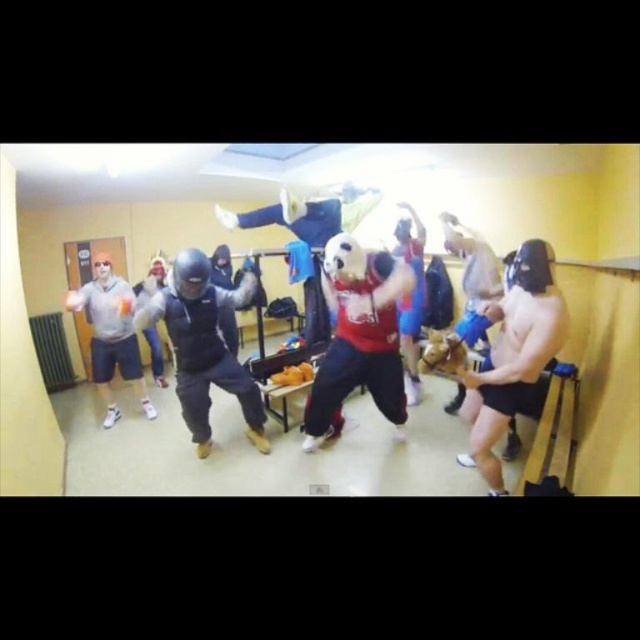
Does point (474, 449) come farther from viewer compared to point (140, 369)?

No, (474, 449) is closer to viewer.

Which is more to the left, shiny metallic helmet at right or matte gray hoodie at left?

matte gray hoodie at left

Between point (522, 332) and point (116, 419), which one is positioned behind?

The point (116, 419) is behind.

The height and width of the screenshot is (640, 640). Identify the location of shiny metallic helmet at right. (513, 355).

Is point (202, 420) positioned in front of point (93, 353)?

Yes.

At what (x,y) coordinates should I click in order to perform the action: click on black matte hoodie at center. Please return your answer as a coordinate pair (x, y). Looking at the image, I should click on (204, 346).

Is point (253, 284) closer to camera compared to point (84, 296)?

Yes, point (253, 284) is closer to viewer.

At what (x,y) coordinates should I click in order to perform the action: click on black matte hoodie at center. Please return your answer as a coordinate pair (x, y). Looking at the image, I should click on (204, 346).

Between point (531, 365) and point (250, 298), which one is positioned in front?

Point (531, 365) is more forward.

Is point (486, 426) positioned behind point (164, 324)?

That is False.

Does point (536, 278) come behind point (177, 340)?

No, (536, 278) is in front of (177, 340).

This screenshot has height=640, width=640. Identify the location of shiny metallic helmet at right. (513, 355).